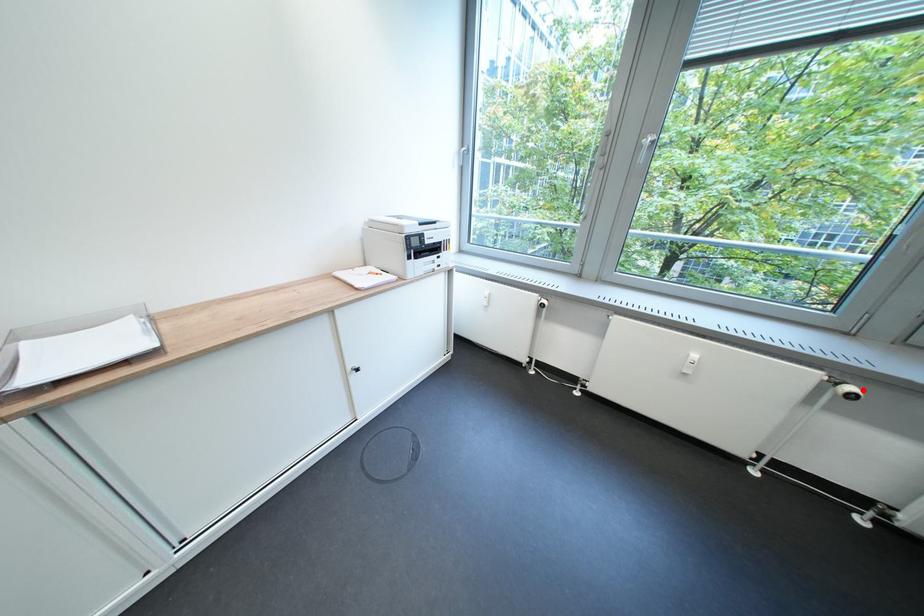
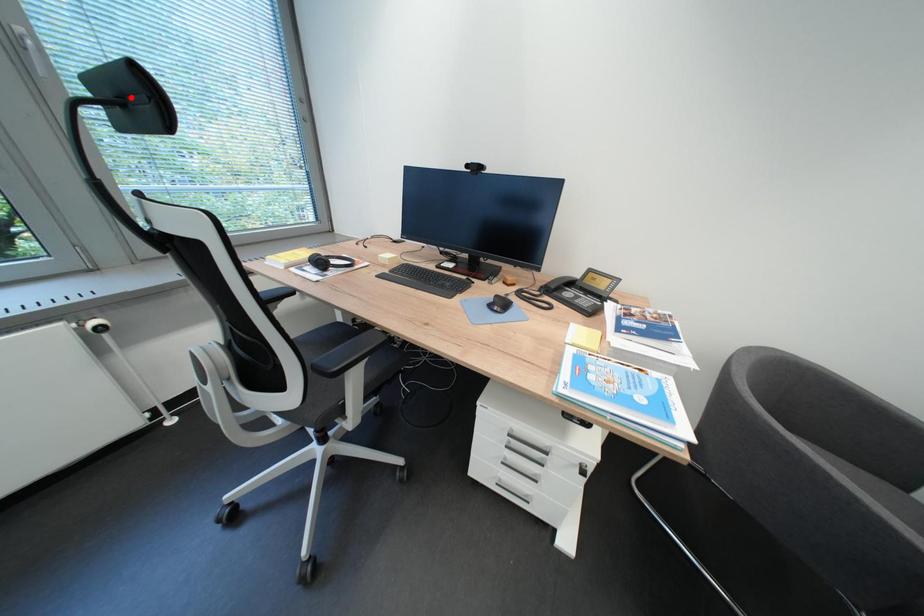
I am providing you with two images of the same scene from different viewpoints. A red point is marked on the first image and another point is marked on the second image. Is the red point in image1 aligned with the point shown in image2?

No